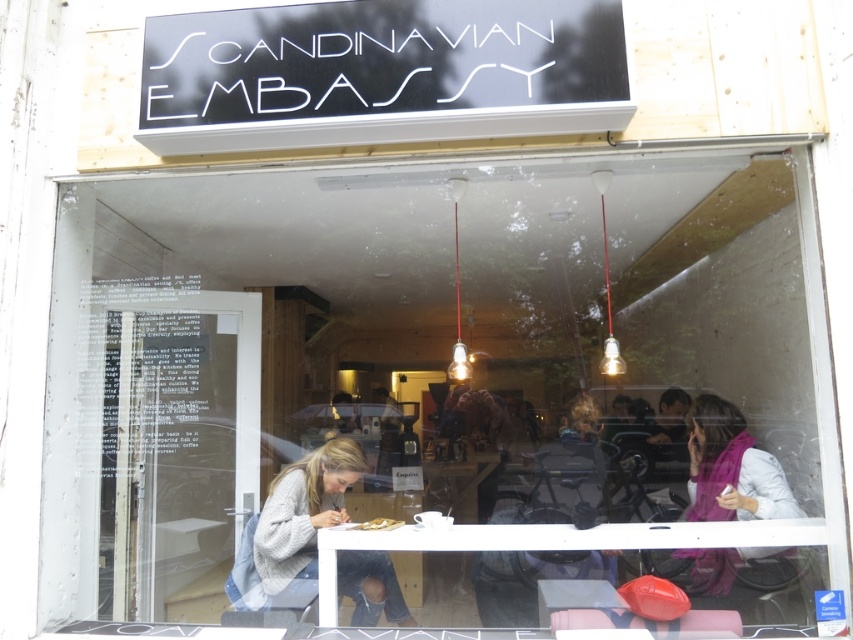
You are standing outside the Scandinavian Embassy cafe and want to enter. The entrance has a transparent glass door at center and a purple scarf at right. Which object is higher from the ground?

The transparent glass door at center is above purple scarf at right, so the transparent glass door at center is higher from the ground.

You are a customer at the Scandinavian Embassy cafe. You notice a purple scarf at right and a white matte plate at center. Which object is closer to the floor?

The purple scarf at right is located below the white matte plate at center, so it is closer to the floor.